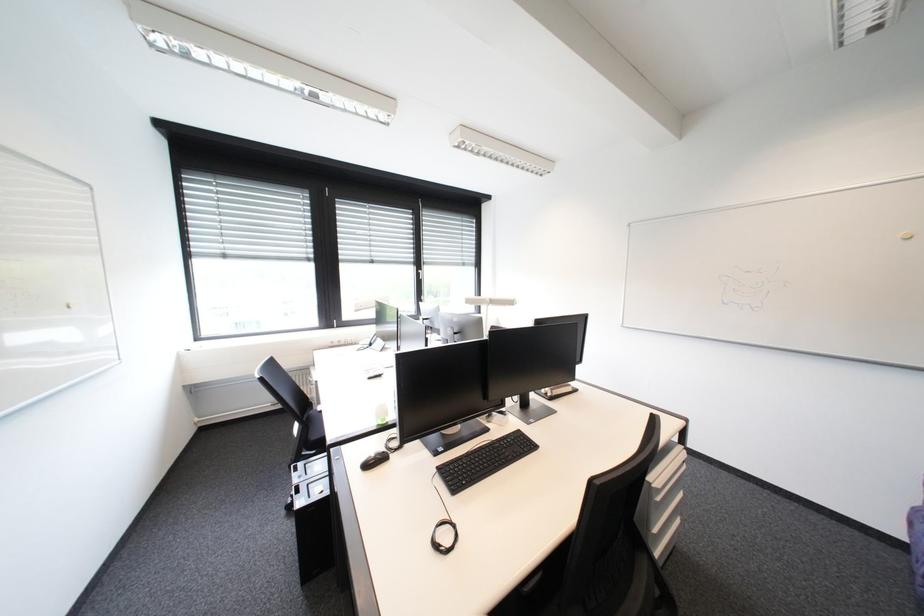
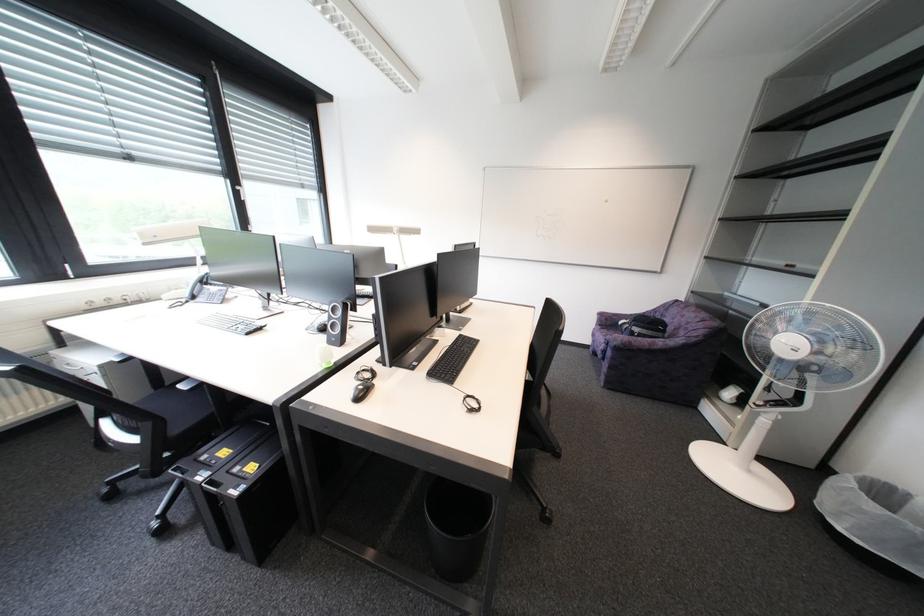
Question: The camera is either moving clockwise (left) or counter-clockwise (right) around the object. The first image is from the beginning of the video and the second image is from the end. Is the camera moving left or right when shooting the video?

Choices:
 (A) Left
 (B) Right

Answer: (A)